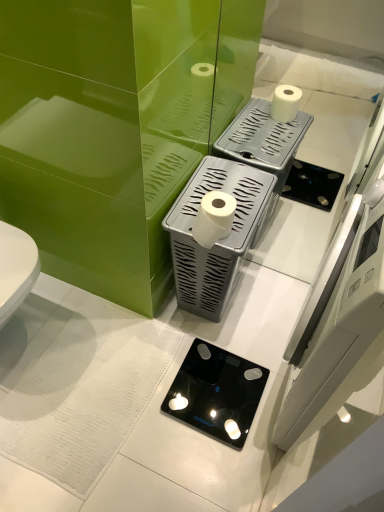
Locate an element on the screen. vacant space behind black glass scale at center, marked as the 1th appliance in a bottom-to-top arrangement is located at coordinates (229, 324).